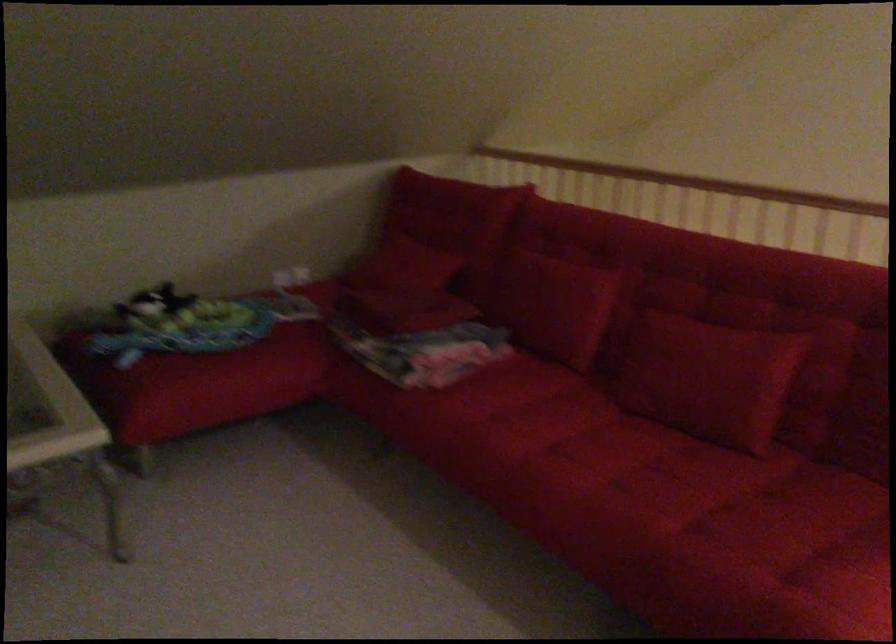
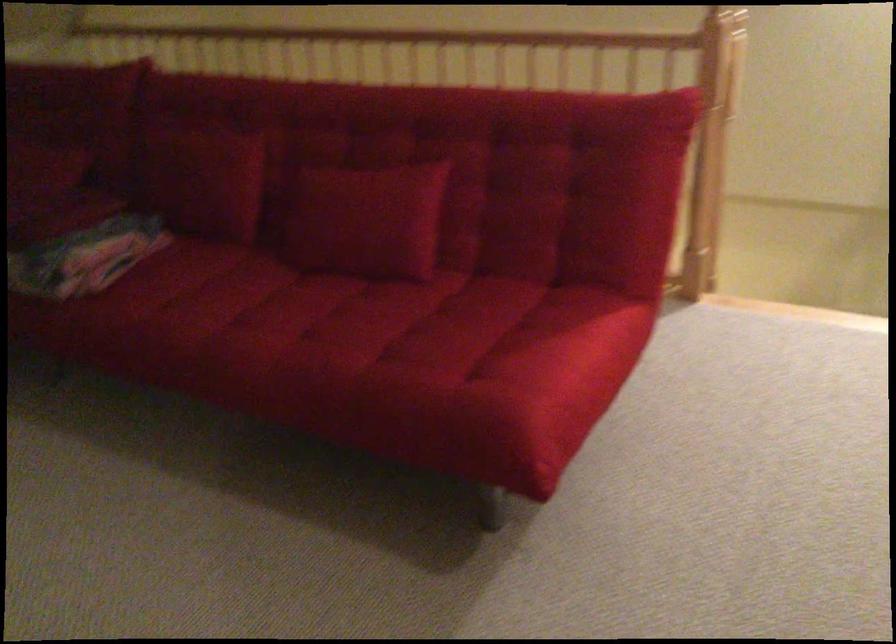
Locate, in the second image, the point that corresponds to point 610,449 in the first image.

(290, 310)